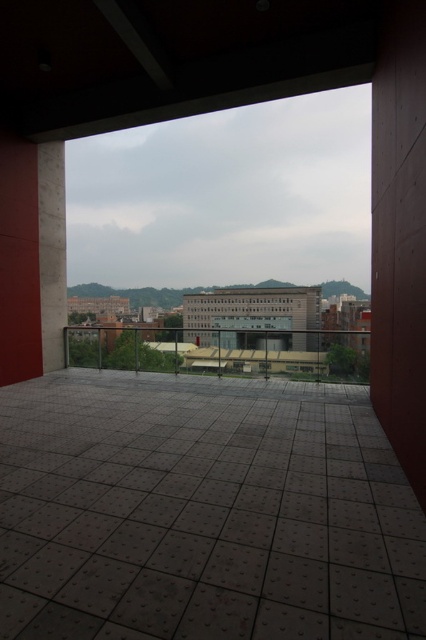
Is point (388, 129) farther from viewer compared to point (42, 246)?

No, (388, 129) is closer to viewer.

Which is above, brown wood pillar at right or concrete pillar at left?

concrete pillar at left

Is point (396, 61) closer to viewer compared to point (46, 218)?

That is True.

Where is `brown wood pillar at right`? The image size is (426, 640). brown wood pillar at right is located at coordinates (400, 236).